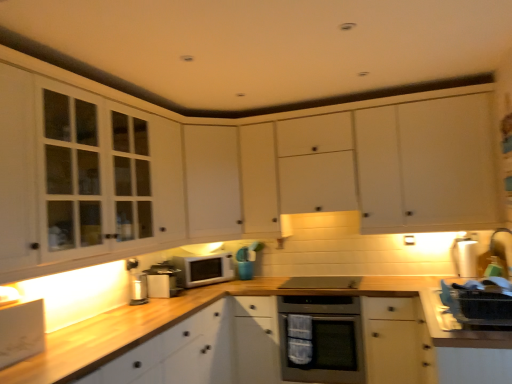
Locate an element on the screen. The image size is (512, 384). vacant location behind white glossy water filter at right, the fourth appliance positioned from the left is located at coordinates 455,269.